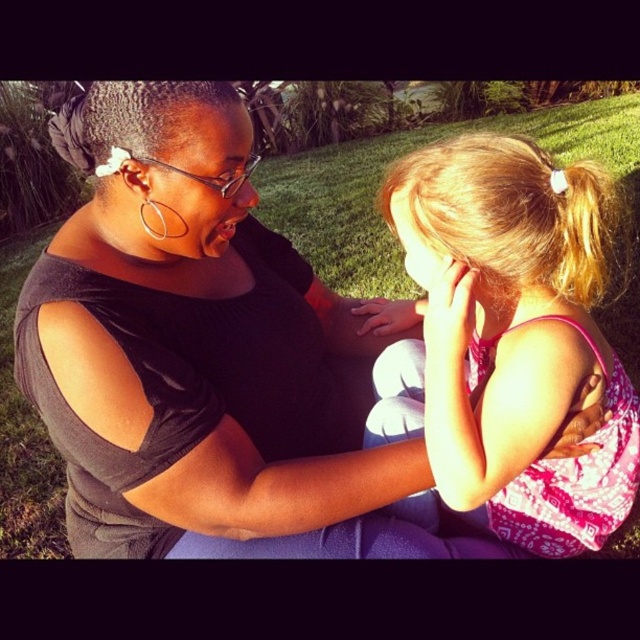
Based on the scene description, what is located at the coordinates point (x=508, y=339)?

The pink fabric dress at center is located at point (x=508, y=339).

You are a photographer planning to take a portrait of the two people in the scene. You notice the pink fabric dress at center and the green grass at center. Which object should you focus on to ensure the subject is in sharp focus while blurring the background?

The pink fabric dress at center is bigger than green grass at center, so focusing on the pink fabric dress at center will keep the subject sharp while blurring the background.